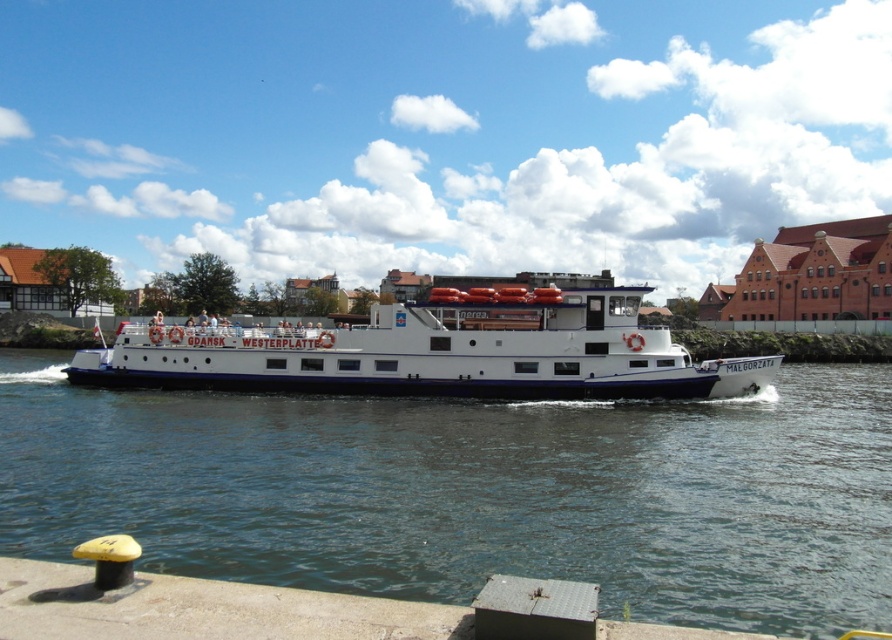
You are a photographer trying to capture the white matte boat at center and the clear blue water at center in a single shot. Based on their positions, which object should you focus on first to ensure both are in frame?

The clear blue water at center is positioned on the left side of white matte boat at center, so you should focus on the white matte boat at center first to ensure both are in frame.

You are standing on the dock and see the clear blue water at center and the white matte boat at center. Which object is positioned lower from your viewpoint?

The clear blue water at center is located below the white matte boat at center, so it is positioned lower from your viewpoint.

You are a photographer trying to capture the white matte boat at center in your shot. Since the clear blue water at center is narrower than the boat, will the boat occupy more space in the photo compared to the water?

Yes, the white matte boat at center will occupy more space in the photo than the clear blue water at center because the boat is wider than the water according to the description.